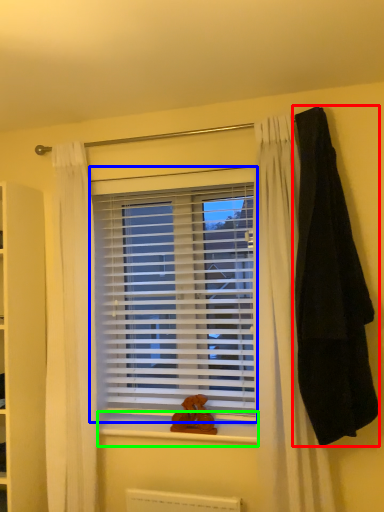
Question: Which is farther away from blanket (highlighted by a red box)? window blind (highlighted by a blue box) or window sill (highlighted by a green box)?

Choices:
 (A) window blind
 (B) window sill

Answer: (B)